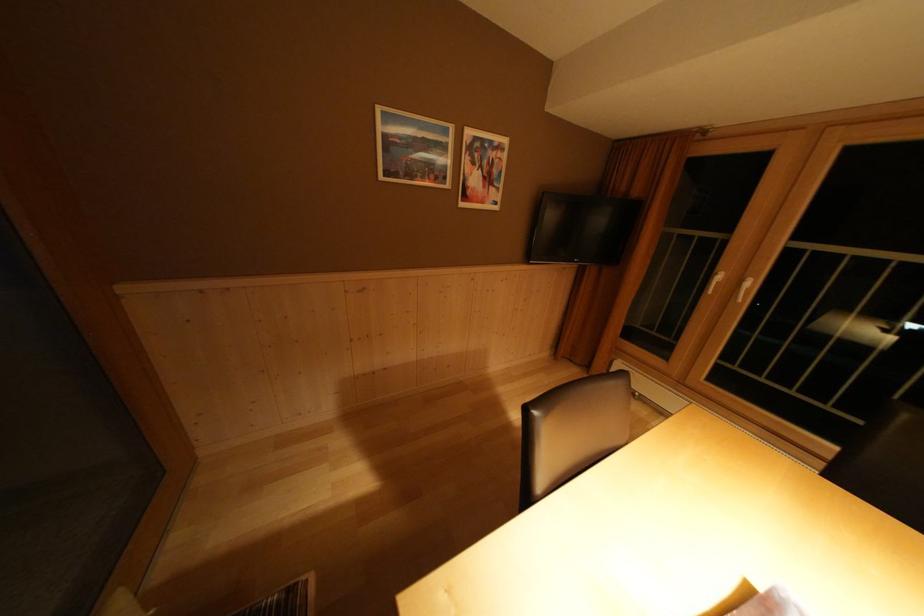
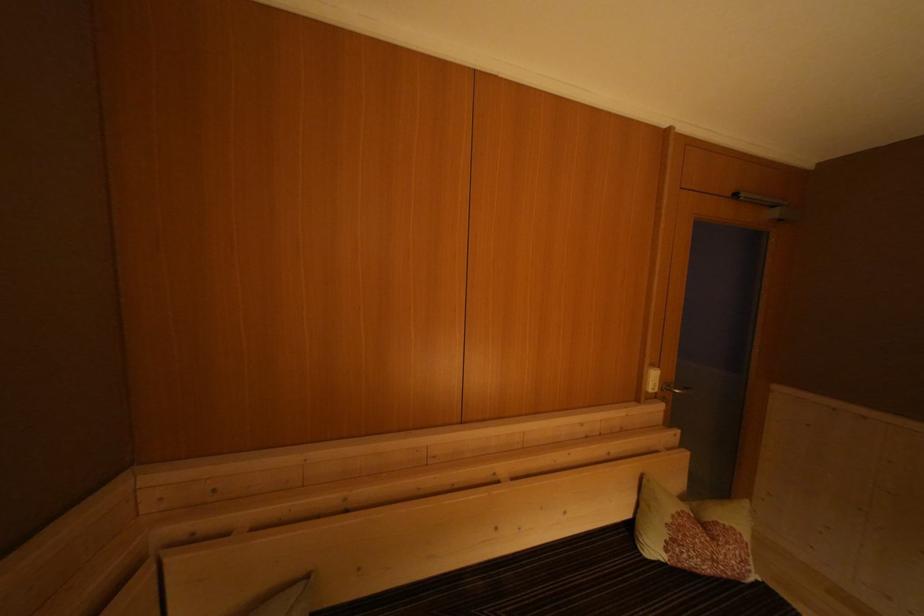
Question: Based on the continuous images, in which direction is the camera rotating? Reply with the corresponding letter.

Choices:
 (A) Left
 (B) Right
 (C) Up
 (D) Down

Answer: (A)